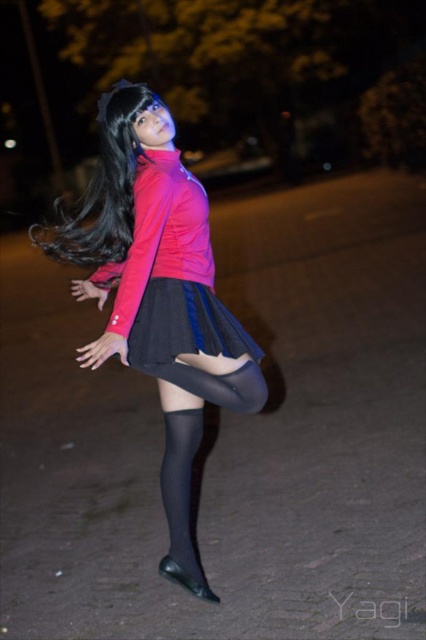
You are a photographer trying to capture the subject in the image. You want to ensure that both the black silky hair at center and the black leather boot at lower center are clearly visible in your shot. Given their sizes, which object might require you to adjust your focus more carefully to avoid blurriness?

The black silky hair at center might be wider than the black leather boot at lower center, so it could require more careful focus adjustment to ensure clarity.

You are a photographer trying to capture the perfect shot of the person in the image. You need to ensure that both the matte pink jacket at center and the black silky hair at center are in focus simultaneously. Given that your camera has a depth of field that can cover 13 inches, will you be able to achieve this?

The matte pink jacket at center and the black silky hair at center are 13.36 inches apart. Since the camera can only cover 13 inches, the distance between them exceeds the depth of field capacity. Therefore, it will be difficult to have both in focus at the same time.